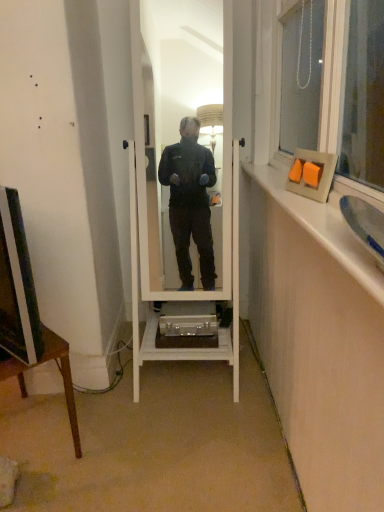
Question: Would you say matte orange picture frame at upper right is outside matte black television at left?

Choices:
 (A) no
 (B) yes

Answer: (B)

Question: Considering the relative positions of matte orange picture frame at upper right and matte black television at left in the image provided, is matte orange picture frame at upper right to the left of matte black television at left from the viewer's perspective?

Choices:
 (A) yes
 (B) no

Answer: (B)

Question: From a real-world perspective, is matte orange picture frame at upper right below matte black television at left?

Choices:
 (A) no
 (B) yes

Answer: (A)

Question: Are matte orange picture frame at upper right and matte black television at left located far from each other?

Choices:
 (A) yes
 (B) no

Answer: (B)

Question: Is the surface of matte orange picture frame at upper right in direct contact with matte black television at left?

Choices:
 (A) no
 (B) yes

Answer: (A)

Question: Can you confirm if matte orange picture frame at upper right is bigger than matte black television at left?

Choices:
 (A) no
 (B) yes

Answer: (A)

Question: From the image's perspective, is matte black television at left on top of wooden frame at upper right?

Choices:
 (A) no
 (B) yes

Answer: (A)

Question: Is matte black television at left directly adjacent to wooden frame at upper right?

Choices:
 (A) yes
 (B) no

Answer: (B)

Question: Can you confirm if matte black television at left is positioned to the left of wooden frame at upper right?

Choices:
 (A) yes
 (B) no

Answer: (A)

Question: Considering the relative sizes of matte black television at left and wooden frame at upper right in the image provided, is matte black television at left taller than wooden frame at upper right?

Choices:
 (A) yes
 (B) no

Answer: (A)

Question: Is matte black television at left not close to wooden frame at upper right?

Choices:
 (A) no
 (B) yes

Answer: (A)

Question: Can you confirm if matte black television at left is thinner than wooden frame at upper right?

Choices:
 (A) no
 (B) yes

Answer: (B)

Question: Considering the relative sizes of matte black television at left and white wooden mirror at center in the image provided, is matte black television at left smaller than white wooden mirror at center?

Choices:
 (A) yes
 (B) no

Answer: (A)